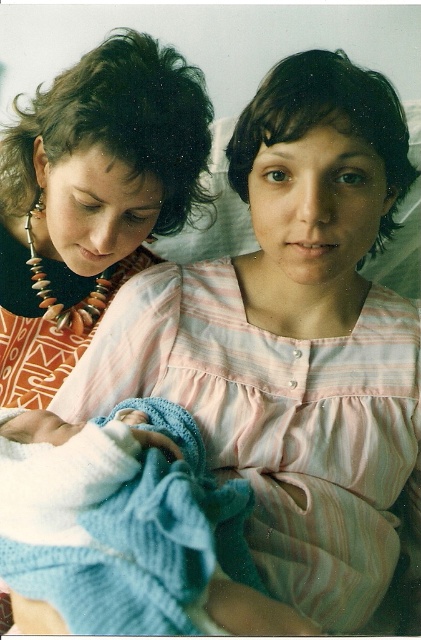
Question: Can you confirm if matte black necklace at upper left is smaller than knitted blue blanket at center?

Choices:
 (A) yes
 (B) no

Answer: (B)

Question: Which point is closer to the camera?

Choices:
 (A) (120, 456)
 (B) (47, 237)

Answer: (A)

Question: Which of the following is the farthest from the observer?

Choices:
 (A) knitted blue blanket at center
 (B) matte black necklace at upper left

Answer: (B)

Question: Is matte black necklace at upper left bigger than knitted blue blanket at center?

Choices:
 (A) yes
 (B) no

Answer: (A)

Question: Is matte black necklace at upper left above knitted blue blanket at center?

Choices:
 (A) no
 (B) yes

Answer: (B)